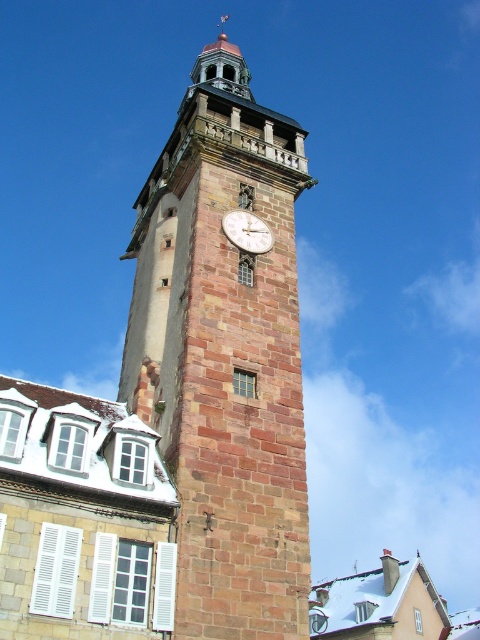
Question: Is brown stone clock tower at center thinner than brick clock at center?

Choices:
 (A) no
 (B) yes

Answer: (A)

Question: Can you confirm if brown stone clock tower at center is positioned below brick clock at center?

Choices:
 (A) yes
 (B) no

Answer: (B)

Question: Considering the relative positions of brown stone clock tower at center and brick clock at center in the image provided, where is brown stone clock tower at center located with respect to brick clock at center?

Choices:
 (A) below
 (B) above

Answer: (B)

Question: Which object appears farthest from the camera in this image?

Choices:
 (A) brick clock at center
 (B) brown stone clock tower at center

Answer: (A)

Question: Among these points, which one is nearest to the camera?

Choices:
 (A) (273, 188)
 (B) (244, 230)

Answer: (B)